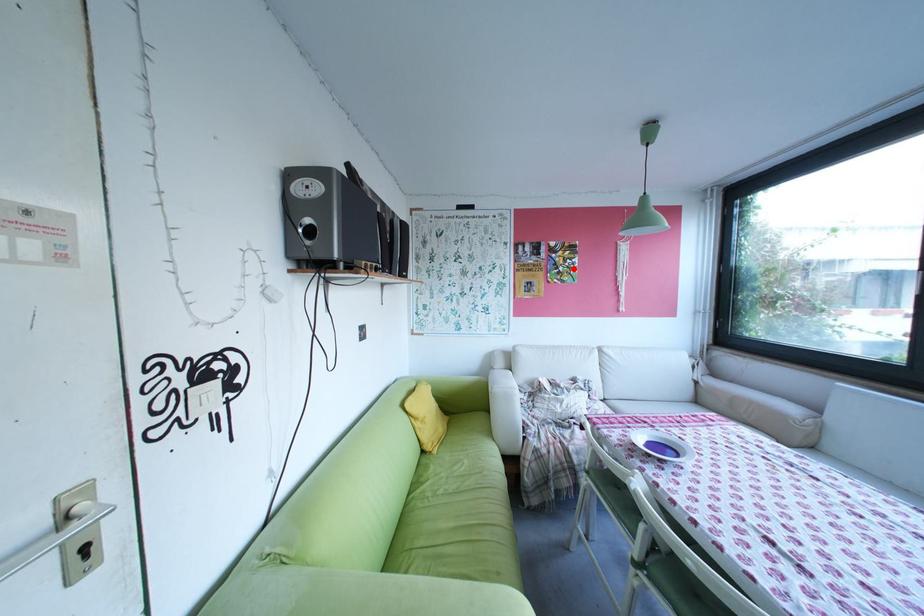
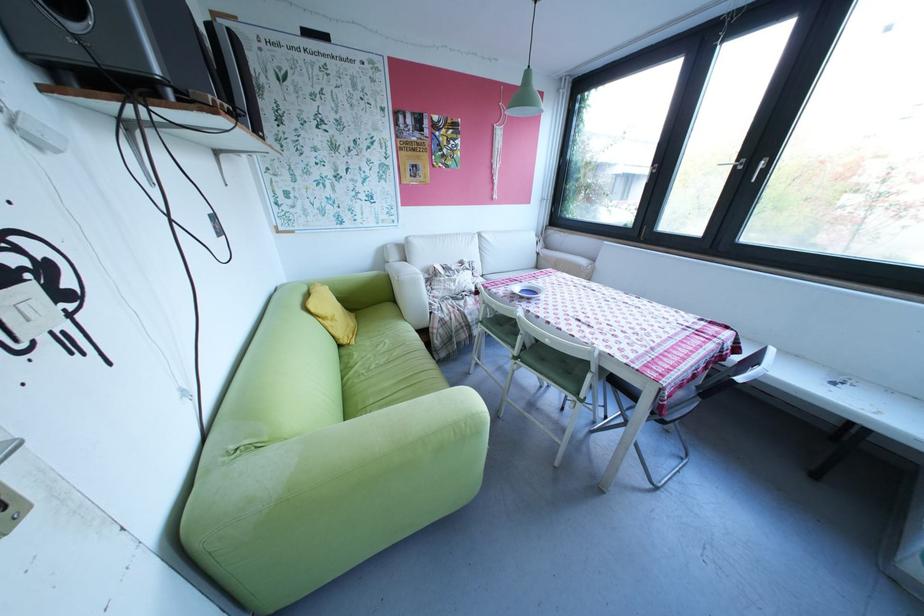
Find the pixel in the second image that matches the highlighted location in the first image.

(457, 151)